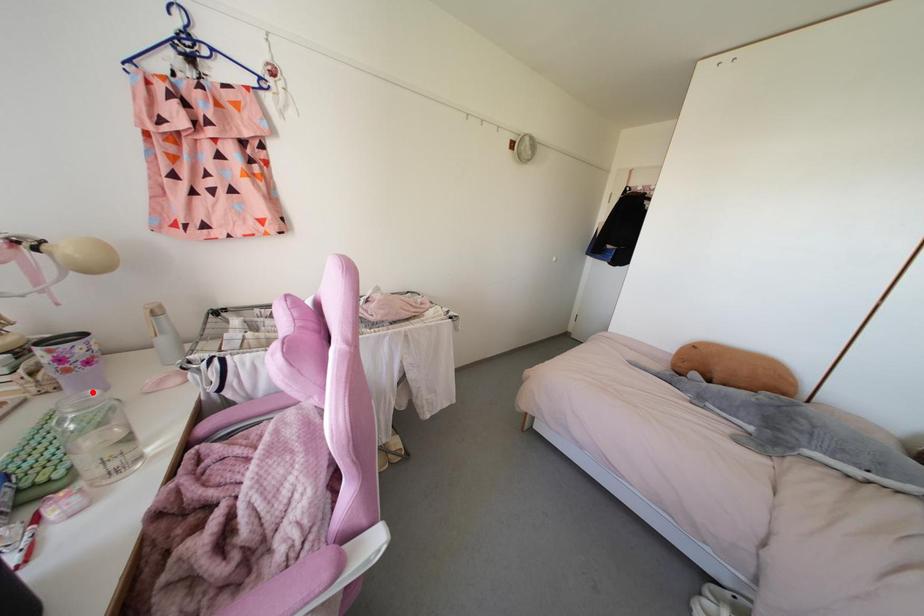
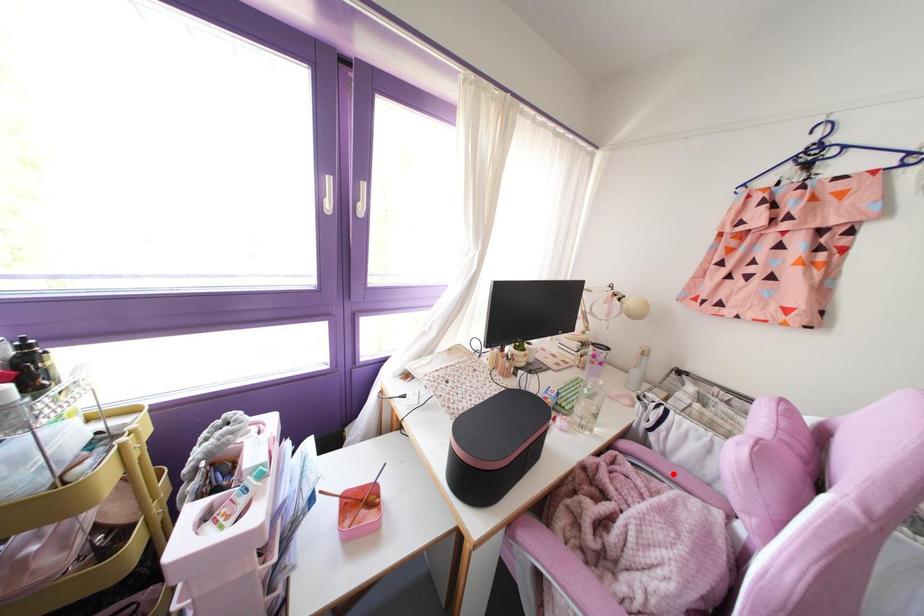
I am providing you with two images of the same scene from different viewpoints. A red point is marked on the first image and another point is marked on the second image. Is the red point in image1 aligned with the point shown in image2?

No